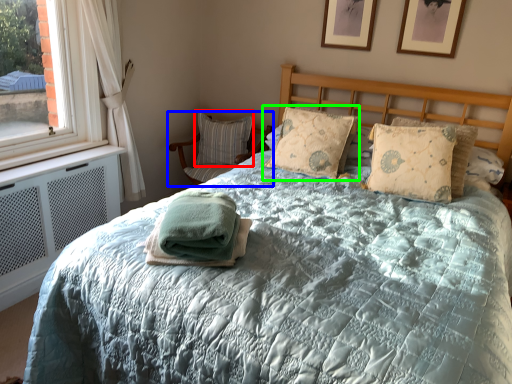
Question: Based on their relative distances, which object is nearer to pillow (highlighted by a red box)? Choose from chair (highlighted by a blue box) and pillow (highlighted by a green box).

Choices:
 (A) chair
 (B) pillow

Answer: (A)